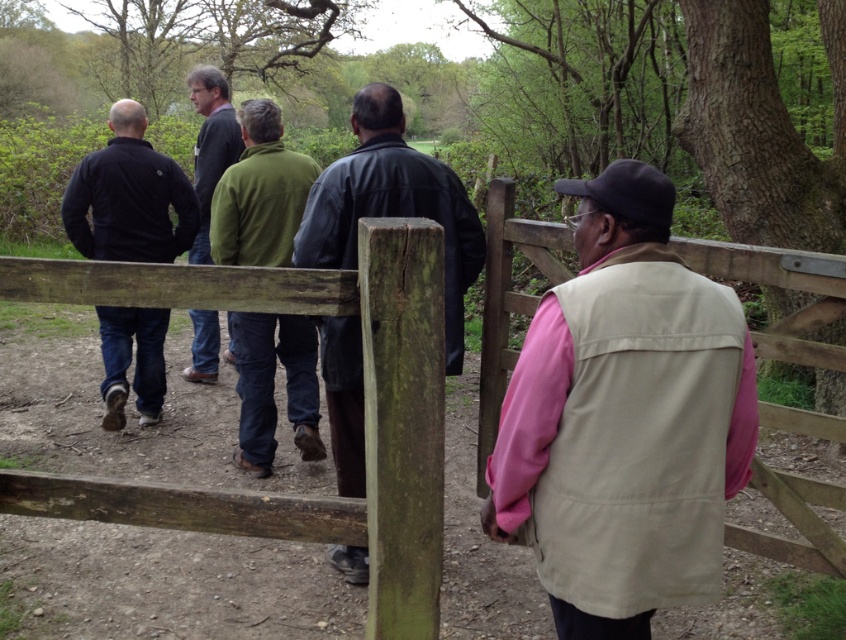
You are trying to decide which jacket to wear for a hike. The green fleece jacket at center is narrower than the dark blue jacket at left. Which jacket would be more comfortable for layering under a backpack?

The green fleece jacket at center is narrower than the dark blue jacket at left, so it would be more comfortable for layering under a backpack as it allows for better movement and less bulk.